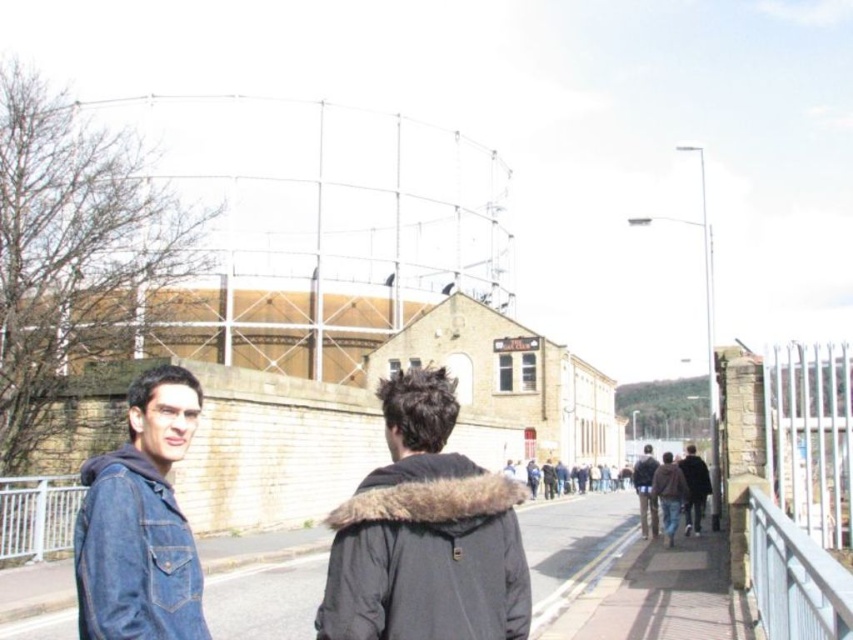
Can you confirm if brushed denim jacket at lower left is positioned to the right of white metal fence at lower left?

Indeed, brushed denim jacket at lower left is positioned on the right side of white metal fence at lower left.

Which is more to the right, brushed denim jacket at lower left or white metal fence at lower left?

brushed denim jacket at lower left

Who is more forward, (171, 595) or (25, 529)?

Point (171, 595)

The image size is (853, 640). In order to click on brushed denim jacket at lower left in this screenshot , I will do `click(134, 554)`.

Consider the image. Is dark brown fur-lined jacket at center bigger than dark brown fur coat at right?

No, dark brown fur-lined jacket at center is not bigger than dark brown fur coat at right.

Is dark brown fur-lined jacket at center to the right of dark brown fur coat at right from the viewer's perspective?

No, dark brown fur-lined jacket at center is not to the right of dark brown fur coat at right.

Identify the location of dark brown fur-lined jacket at center. (426, 556).

Can you confirm if smooth concrete pavement at center is thinner than denim jacket at lower right?

No, smooth concrete pavement at center is not thinner than denim jacket at lower right.

Between smooth concrete pavement at center and denim jacket at lower right, which one is positioned higher?

denim jacket at lower right

Who is more forward, (x=538, y=582) or (x=672, y=518)?

Point (x=538, y=582) is in front.

Locate an element on the screen. smooth concrete pavement at center is located at coordinates (573, 547).